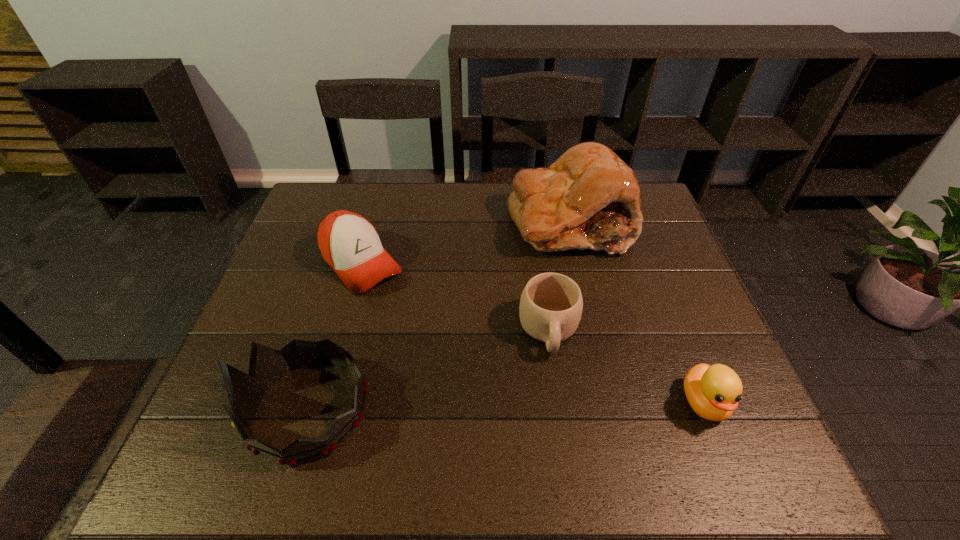
You are a GUI agent. You are given a task and a screenshot of the screen. Output one action in this format:
    pyautogui.click(x=<x>, y=<y>)
    Task: Click on the baseball cap that is positioned at the left edge
    
    Given the screenshot: What is the action you would take?
    pyautogui.click(x=350, y=245)

Identify the location of duckling that is positioned at the right edge. The height and width of the screenshot is (540, 960). (713, 392).

The height and width of the screenshot is (540, 960). I want to click on bread at the right edge, so click(x=588, y=198).

Identify the location of object that is at the near left corner. The image size is (960, 540). (267, 365).

In order to click on object that is at the far right corner in this screenshot , I will do `click(588, 198)`.

At what (x,y) coordinates should I click in order to perform the action: click on object that is at the near right corner. Please return your answer as a coordinate pair (x, y). Looking at the image, I should click on (713, 392).

The height and width of the screenshot is (540, 960). What are the coordinates of `free space at the far edge of the desktop` in the screenshot? It's located at (470, 197).

This screenshot has height=540, width=960. Find the location of `vacant area at the near edge of the desktop`. vacant area at the near edge of the desktop is located at coordinates (538, 422).

Locate an element on the screen. The height and width of the screenshot is (540, 960). free space at the right edge of the desktop is located at coordinates (675, 261).

This screenshot has height=540, width=960. Identify the location of vacant space at the far right corner. (640, 187).